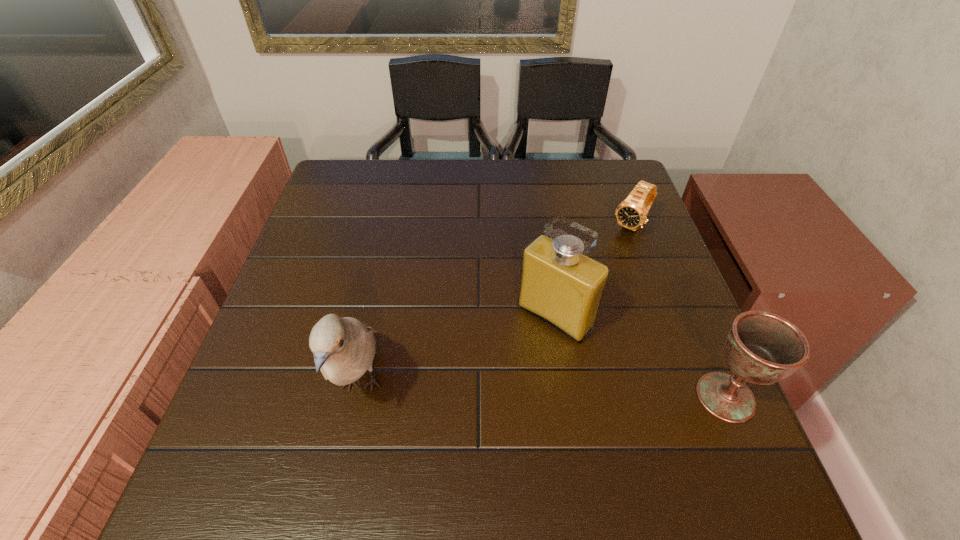
Image resolution: width=960 pixels, height=540 pixels. What are the coordinates of `vacant area situated on the front-facing side of the second object from left to right` in the screenshot? It's located at (475, 401).

Identify the location of vacant space situated 0.070m on the front-facing side of the second object from left to right. Image resolution: width=960 pixels, height=540 pixels. (514, 360).

Locate an element on the screen. The width and height of the screenshot is (960, 540). bird that is at the near edge is located at coordinates (344, 348).

Locate an element on the screen. chalice that is positioned at the near edge is located at coordinates (761, 348).

At what (x,y) coordinates should I click in order to perform the action: click on chalice that is at the right edge. Please return your answer as a coordinate pair (x, y). This screenshot has height=540, width=960. Looking at the image, I should click on (761, 348).

Identify the location of watch located in the right edge section of the desktop. Image resolution: width=960 pixels, height=540 pixels. (631, 213).

Where is `object that is at the near right corner`? object that is at the near right corner is located at coordinates (761, 348).

What are the coordinates of `vacant space at the far edge` in the screenshot? It's located at (x=492, y=174).

Identify the location of blank space at the left edge of the desktop. (349, 274).

The height and width of the screenshot is (540, 960). Identify the location of vacant space at the right edge of the desktop. (687, 354).